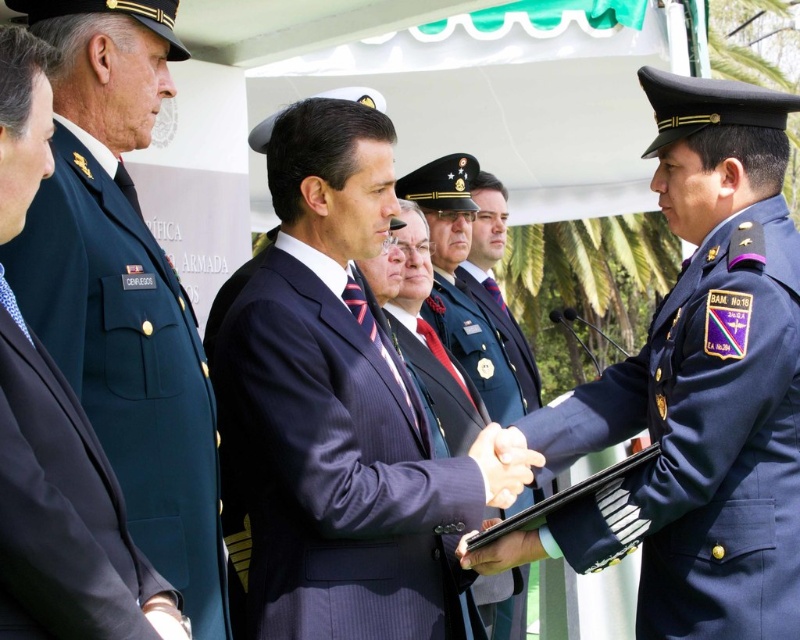
Question: Which object appears closest to the camera in this image?

Choices:
 (A) navy blue fabric uniform at right
 (B) shiny blue uniform at center
 (C) black matte tablet at center
 (D) navy blue pinstripe suit at center

Answer: (A)

Question: Which point is closer to the camera?

Choices:
 (A) (460, 540)
 (B) (474, 280)

Answer: (A)

Question: Is shiny blue uniform at center behind black matte tablet at center?

Choices:
 (A) yes
 (B) no

Answer: (A)

Question: Among these points, which one is nearest to the camera?

Choices:
 (A) (517, 556)
 (B) (141, 486)

Answer: (B)

Question: Does navy blue fabric uniform at right have a greater width compared to navy blue pinstripe suit at center?

Choices:
 (A) yes
 (B) no

Answer: (B)

Question: Does navy blue pinstripe suit at center have a lesser width compared to shiny blue uniform at center?

Choices:
 (A) no
 (B) yes

Answer: (A)